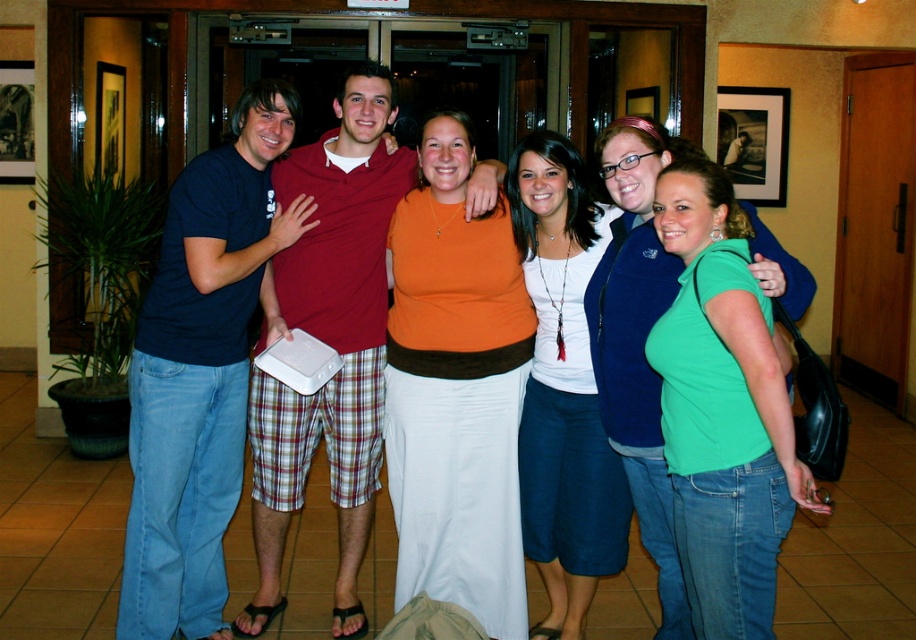
Does matte white box at center come behind white matte shirt at center?

Yes, it is behind white matte shirt at center.

Does matte white box at center have a lesser width compared to white matte shirt at center?

In fact, matte white box at center might be wider than white matte shirt at center.

What do you see at coordinates (330, 342) in the screenshot?
I see `matte white box at center` at bounding box center [330, 342].

The height and width of the screenshot is (640, 916). What are the coordinates of `matte white box at center` in the screenshot? It's located at (330, 342).

What do you see at coordinates (456, 387) in the screenshot?
I see `orange matte shirt at center` at bounding box center [456, 387].

Where is `orange matte shirt at center`? The width and height of the screenshot is (916, 640). orange matte shirt at center is located at coordinates (456, 387).

In order to click on orange matte shirt at center in this screenshot , I will do [x=456, y=387].

Is matte blue jeans at left closer to camera compared to matte white box at center?

Yes.

Between matte blue jeans at left and matte white box at center, which one is positioned higher?

matte white box at center is above.

The image size is (916, 640). Find the location of `matte blue jeans at left`. matte blue jeans at left is located at coordinates (202, 369).